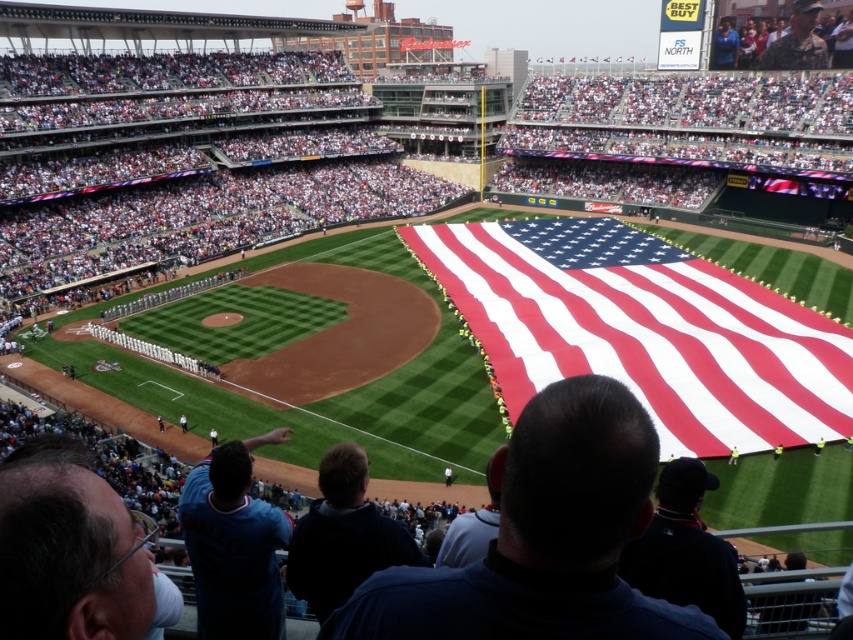
Question: Which point is closer to the camera?

Choices:
 (A) (737, 454)
 (B) (445, 244)
 (C) (196, 586)

Answer: (C)

Question: Which object is positioned farthest from the red-white striped fabric at center?

Choices:
 (A) blue jersey at lower left
 (B) yellow fabric at lower right

Answer: (A)

Question: Which of these objects is positioned closest to the yellow fabric at lower right?

Choices:
 (A) blue jersey at lower left
 (B) red-white striped fabric at center

Answer: (A)

Question: Can you confirm if blue jersey at lower left is positioned to the right of yellow fabric at lower right?

Choices:
 (A) no
 (B) yes

Answer: (A)

Question: Can you confirm if red-white striped fabric at center is smaller than blue jersey at lower left?

Choices:
 (A) no
 (B) yes

Answer: (A)

Question: Is blue jersey at lower left thinner than yellow fabric at lower right?

Choices:
 (A) yes
 (B) no

Answer: (A)